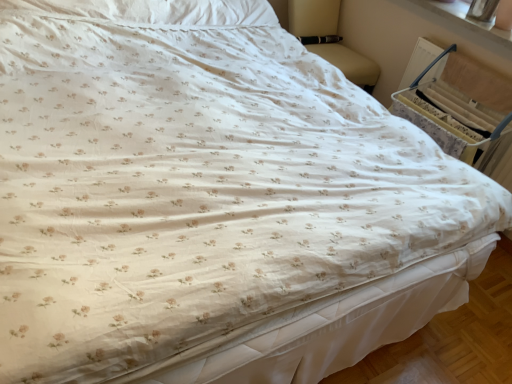
What do you see at coordinates (330, 40) in the screenshot?
I see `beige fabric armchair at upper right` at bounding box center [330, 40].

Find the location of `beige fabric armchair at upper right`. beige fabric armchair at upper right is located at coordinates coord(330,40).

Identify the location of beige fabric armchair at upper right. This screenshot has width=512, height=384. (330, 40).